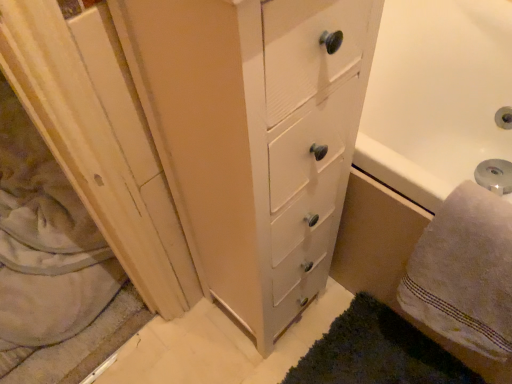
This screenshot has height=384, width=512. What do you see at coordinates (100, 140) in the screenshot? I see `wooden screen door at left` at bounding box center [100, 140].

Find the location of `white fluffy towel at lower right`. white fluffy towel at lower right is located at coordinates (464, 272).

Where is `wooden screen door at left`? wooden screen door at left is located at coordinates (100, 140).

Would you say dark green shaggy rug at lower right contains white fluffy towel at lower right?

No, white fluffy towel at lower right is not surrounded by dark green shaggy rug at lower right.

Is dark green shaggy rug at lower right facing towards white fluffy towel at lower right?

No.

How distant is dark green shaggy rug at lower right from white fluffy towel at lower right?

11.98 inches.

From a real-world perspective, between dark green shaggy rug at lower right and white fluffy towel at lower right, who is vertically lower?

dark green shaggy rug at lower right is physically lower.

Is white fluffy towel at lower right positioned far away from dark green shaggy rug at lower right?

No.

Considering the relative sizes of white fluffy towel at lower right and dark green shaggy rug at lower right in the image provided, is white fluffy towel at lower right thinner than dark green shaggy rug at lower right?

Yes.

Between point (488, 288) and point (357, 378), which one is positioned behind?

Positioned behind is point (357, 378).

From a real-world perspective, who is located higher, white fluffy towel at lower right or dark green shaggy rug at lower right?

From a 3D spatial view, white fluffy towel at lower right is above.

Considering the relative positions of wooden screen door at left and dark green shaggy rug at lower right in the image provided, is wooden screen door at left to the right of dark green shaggy rug at lower right from the viewer's perspective?

In fact, wooden screen door at left is to the left of dark green shaggy rug at lower right.

Does point (83, 176) appear closer or farther from the camera than point (366, 381)?

Point (83, 176).

Looking at this image, in terms of height, does wooden screen door at left look taller or shorter compared to dark green shaggy rug at lower right?

wooden screen door at left is taller than dark green shaggy rug at lower right.

From the image's perspective, is dark green shaggy rug at lower right beneath wooden screen door at left?

Yes.

Does dark green shaggy rug at lower right have a lesser height compared to wooden screen door at left?

Indeed, dark green shaggy rug at lower right has a lesser height compared to wooden screen door at left.

Considering the relative sizes of dark green shaggy rug at lower right and wooden screen door at left in the image provided, is dark green shaggy rug at lower right wider than wooden screen door at left?

In fact, dark green shaggy rug at lower right might be narrower than wooden screen door at left.

Measure the distance from dark green shaggy rug at lower right to wooden screen door at left.

dark green shaggy rug at lower right is 21.95 inches away from wooden screen door at left.

Between white fluffy towel at lower right and wooden screen door at left, which one has larger width?

Wider between the two is wooden screen door at left.

Can we say white fluffy towel at lower right lies outside wooden screen door at left?

Indeed, white fluffy towel at lower right is completely outside wooden screen door at left.

From a real-world perspective, is white fluffy towel at lower right located higher than wooden screen door at left?

Yes, from a real-world perspective, white fluffy towel at lower right is over wooden screen door at left

Considering the sizes of objects white fluffy towel at lower right and wooden screen door at left in the image provided, who is shorter, white fluffy towel at lower right or wooden screen door at left?

wooden screen door at left.

Do you think wooden screen door at left is within white fluffy towel at lower right, or outside of it?

The correct answer is: outside.

Does wooden screen door at left turn towards white fluffy towel at lower right?

No, wooden screen door at left does not turn towards white fluffy towel at lower right.

From the picture: What's the angular difference between wooden screen door at left and white fluffy towel at lower right's facing directions?

The angular difference between wooden screen door at left and white fluffy towel at lower right is 0.78 degrees.

I want to click on bath mat beneath the white fluffy towel at lower right (from a real-world perspective), so click(377, 352).

Identify the location of bath mat below the white fluffy towel at lower right (from the image's perspective). (377, 352).

From the image, which object appears to be nearer to white fluffy towel at lower right, wooden screen door at left or dark green shaggy rug at lower right?

The object closer to white fluffy towel at lower right is dark green shaggy rug at lower right.

When comparing their distances from dark green shaggy rug at lower right, does white fluffy towel at lower right or wooden screen door at left seem further?

wooden screen door at left.

Looking at this image, considering their positions, is dark green shaggy rug at lower right positioned further to white fluffy towel at lower right than wooden screen door at left?

wooden screen door at left lies further to white fluffy towel at lower right than the other object.

Based on their spatial positions, is dark green shaggy rug at lower right or white fluffy towel at lower right closer to wooden screen door at left?

The object closer to wooden screen door at left is dark green shaggy rug at lower right.

From the image, which object appears to be nearer to wooden screen door at left, white fluffy towel at lower right or dark green shaggy rug at lower right?

The object closer to wooden screen door at left is dark green shaggy rug at lower right.

Based on their spatial positions, is wooden screen door at left or white fluffy towel at lower right further from dark green shaggy rug at lower right?

wooden screen door at left lies further to dark green shaggy rug at lower right than the other object.

Identify the location of bath mat situated between wooden screen door at left and white fluffy towel at lower right from left to right. The height and width of the screenshot is (384, 512). (377, 352).